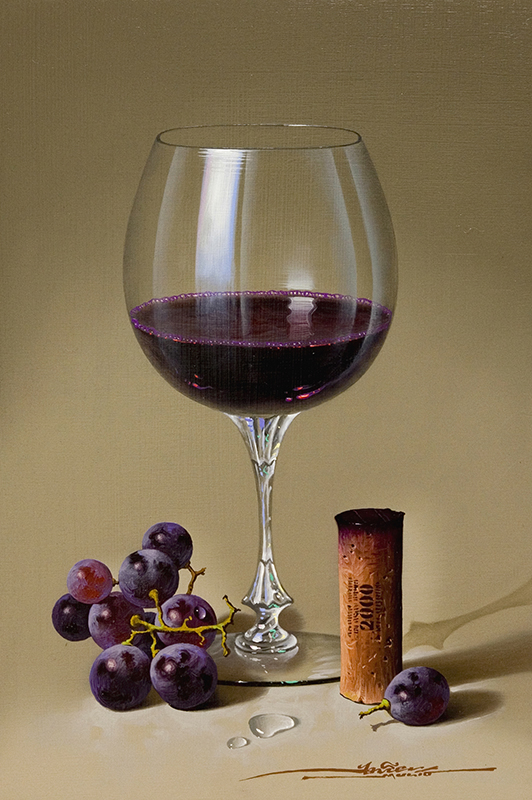
Where is `base of glass`? The width and height of the screenshot is (532, 800). base of glass is located at coordinates (315, 648).